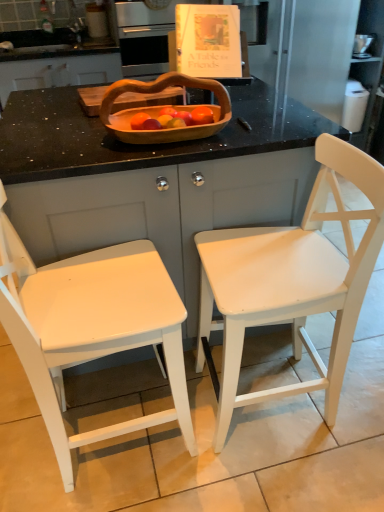
This screenshot has height=512, width=384. What are the coordinates of `vacant space in white painted wood chair at left, which is the first chair in left-to-right order (from a real-world perspective)` in the screenshot? It's located at (121, 438).